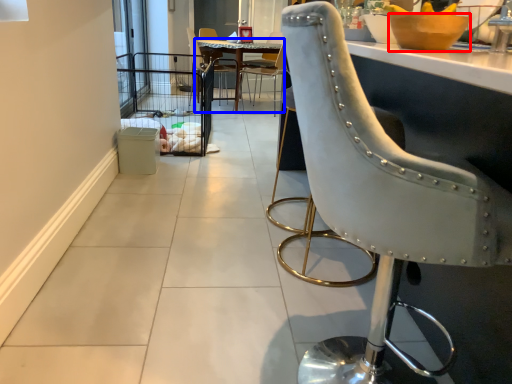
Question: Which object is closer to the camera taking this photo, bowl (highlighted by a red box) or kitchen & dining room table (highlighted by a blue box)?

Choices:
 (A) bowl
 (B) kitchen & dining room table

Answer: (A)